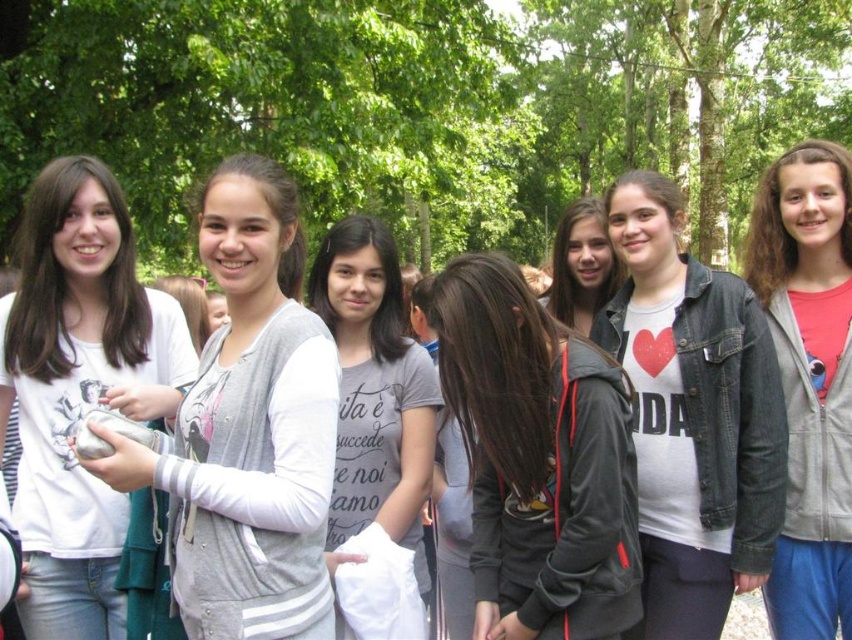
Question: Among these points, which one is nearest to the camera?

Choices:
 (A) (602, 576)
 (B) (60, 321)
 (C) (561, 246)

Answer: (A)

Question: Among these points, which one is farthest from the camera?

Choices:
 (A) (525, 346)
 (B) (426, 540)

Answer: (B)

Question: Does gray fleece jacket at center have a larger size compared to denim jacket at center?

Choices:
 (A) yes
 (B) no

Answer: (B)

Question: Is gray fleece jacket at center further to camera compared to denim jacket at center?

Choices:
 (A) no
 (B) yes

Answer: (A)

Question: Is gray fabric hoodie at center wider than matte gray hoodie at right?

Choices:
 (A) no
 (B) yes

Answer: (B)

Question: Which object appears farthest from the camera in this image?

Choices:
 (A) white matte jacket at center
 (B) gray fabric hoodie at center
 (C) matte gray hoodie at right

Answer: (A)